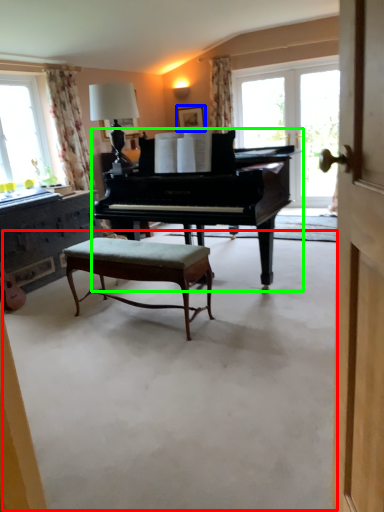
Question: Which object is positioned closest to concrete (highlighted by a red box)? Select from picture frame (highlighted by a blue box) and piano (highlighted by a green box).

Choices:
 (A) picture frame
 (B) piano

Answer: (B)